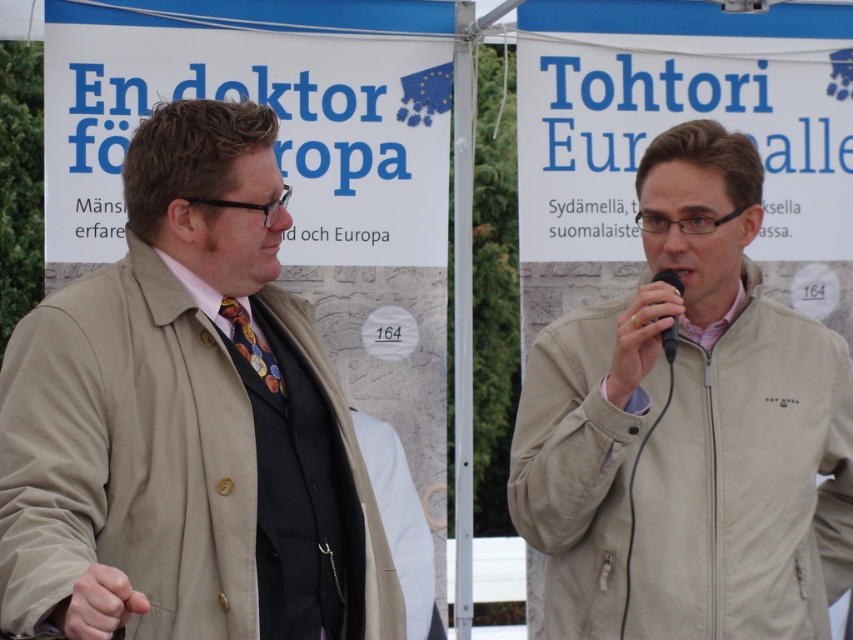
Who is shorter, beige fabric trench coat at left or shiny gold tie at center?

shiny gold tie at center is shorter.

Does point (61, 547) come behind point (267, 353)?

No.

What do you see at coordinates (126, 456) in the screenshot?
I see `beige fabric trench coat at left` at bounding box center [126, 456].

In order to click on beige fabric trench coat at left in this screenshot , I will do `click(126, 456)`.

Does point (20, 528) come behind point (670, 349)?

No.

From the picture: Is the position of beige fabric trench coat at left more distant than that of black plastic microphone at center?

No, it is not.

Who is more forward, (57, 499) or (668, 269)?

Point (57, 499) is in front.

Locate an element on the screen. This screenshot has width=853, height=640. beige fabric trench coat at left is located at coordinates (126, 456).

In the scene shown: Can you confirm if beige fabric jacket at right is positioned below shiny gold tie at center?

Indeed, beige fabric jacket at right is positioned under shiny gold tie at center.

Who is positioned more to the right, beige fabric jacket at right or shiny gold tie at center?

beige fabric jacket at right is more to the right.

Is point (679, 484) more distant than point (283, 403)?

That is True.

Find the location of a particular element. beige fabric jacket at right is located at coordinates (747, 483).